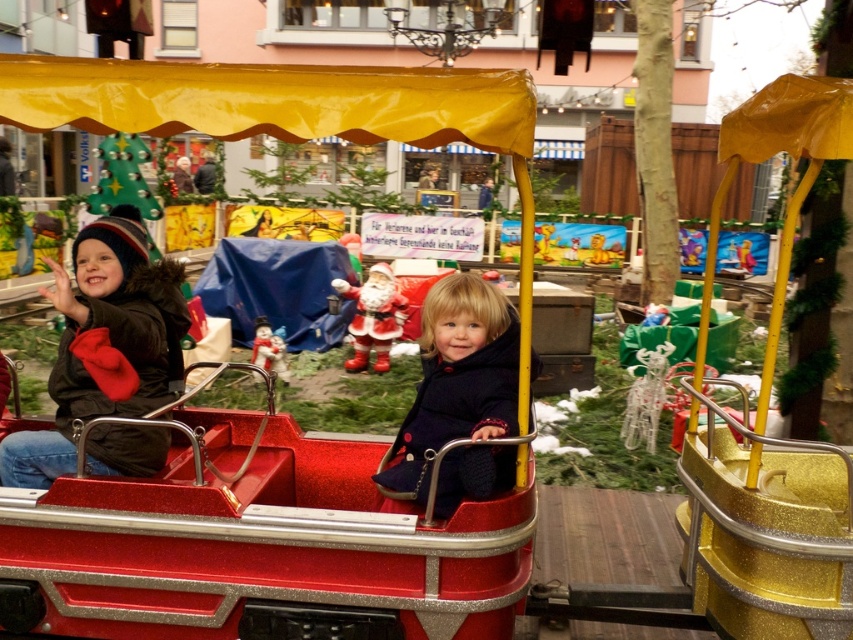
The width and height of the screenshot is (853, 640). What do you see at coordinates (258, 547) in the screenshot? I see `shiny red wagon at center` at bounding box center [258, 547].

Is point (241, 451) positioned before point (514, 472)?

No, it is behind (514, 472).

In order to click on shiny red wagon at center in this screenshot , I will do `click(258, 547)`.

You are a GUI agent. You are given a task and a screenshot of the screen. Output one action in this format:
    pyautogui.click(x=<x>, y=<y>)
    Task: Click on the shiny red wagon at center
    The width and height of the screenshot is (853, 640).
    Given the screenshot: What is the action you would take?
    pyautogui.click(x=258, y=547)

Where is `shiny red wagon at center`? This screenshot has width=853, height=640. shiny red wagon at center is located at coordinates (258, 547).

Does point (177, 353) come in front of point (431, 384)?

No, (177, 353) is behind (431, 384).

Locate an element on the screen. The width and height of the screenshot is (853, 640). matte black jacket at left is located at coordinates (103, 342).